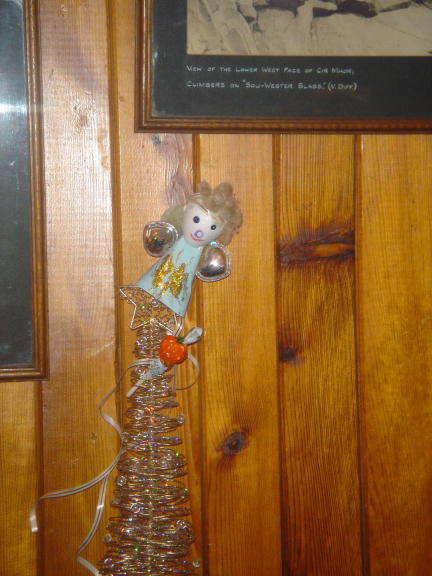
Identify the location of christmas tree topper angel. 184,262.